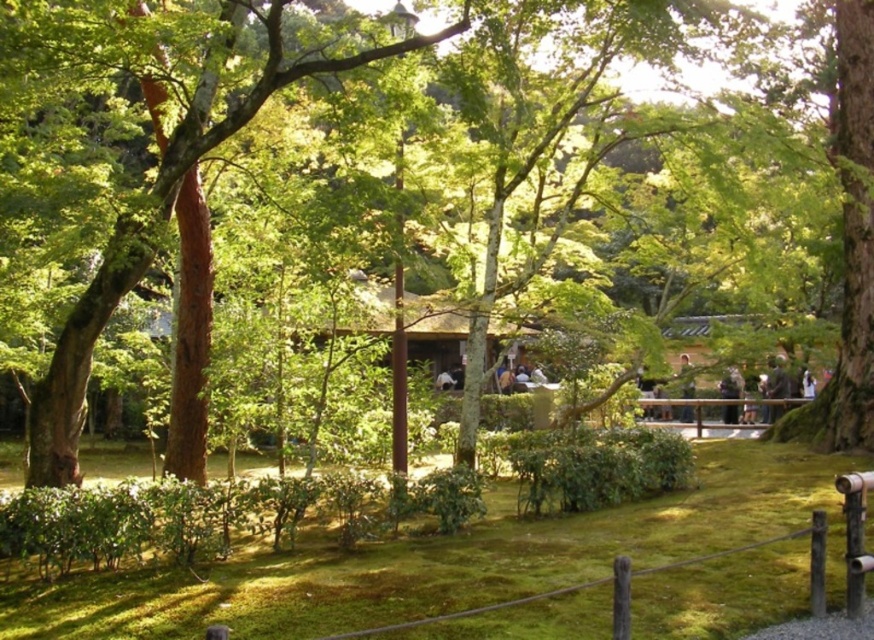
Question: Does dark gray fabric jacket at lower right have a larger size compared to dark brown wooden bench at center?

Choices:
 (A) yes
 (B) no

Answer: (B)

Question: Which of the following is the closest to the observer?

Choices:
 (A) light brown wooden post at center
 (B) white matte person at upper right

Answer: (B)

Question: Does green mossy grass at center appear over dark brown leather jacket at right?

Choices:
 (A) no
 (B) yes

Answer: (A)

Question: Can you confirm if dark brown wooden bench at center is wider than white matte person at upper right?

Choices:
 (A) yes
 (B) no

Answer: (A)

Question: Which object is the farthest from the white matte person at upper right?

Choices:
 (A) dark brown leather jacket at right
 (B) dark brown wooden bench at center
 (C) light brown wooden post at center
 (D) dark gray fabric jacket at lower right

Answer: (B)

Question: Which of the following is the closest to the observer?

Choices:
 (A) green mossy grass at center
 (B) light brown wooden post at center
 (C) white matte person at upper right
 (D) dark brown wooden bench at center

Answer: (A)